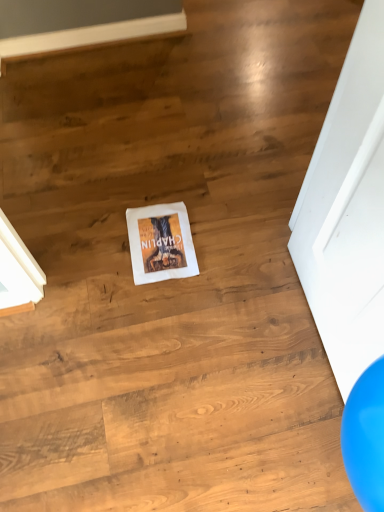
Where is `vacant space behind white cloth at center`? This screenshot has height=512, width=384. vacant space behind white cloth at center is located at coordinates (161, 185).